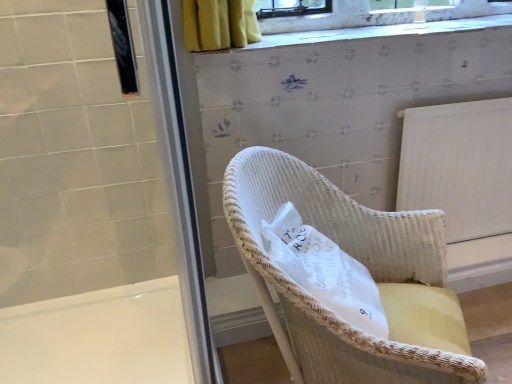
Question: Is white wicker chair at center at the back of white glossy bath at lower left?

Choices:
 (A) yes
 (B) no

Answer: (B)

Question: Would you say white glossy bath at lower left is a long distance from white wicker chair at center?

Choices:
 (A) no
 (B) yes

Answer: (A)

Question: Is white glossy bath at lower left smaller than white wicker chair at center?

Choices:
 (A) yes
 (B) no

Answer: (B)

Question: Does white glossy bath at lower left turn towards white wicker chair at center?

Choices:
 (A) yes
 (B) no

Answer: (B)

Question: Is white glossy bath at lower left in front of white wicker chair at center?

Choices:
 (A) yes
 (B) no

Answer: (B)

Question: From the image's perspective, is white glossy bath at lower left located above white wicker chair at center?

Choices:
 (A) yes
 (B) no

Answer: (B)

Question: Considering the relative sizes of white glossy screen door at upper left, which appears as the 1th screen door when viewed from the left, and white wicker chair at center in the image provided, is white glossy screen door at upper left, which appears as the 1th screen door when viewed from the left, shorter than white wicker chair at center?

Choices:
 (A) no
 (B) yes

Answer: (A)

Question: From the image's perspective, is white glossy screen door at upper left, the 2th screen door in the right-to-left sequence, on top of white wicker chair at center?

Choices:
 (A) no
 (B) yes

Answer: (B)

Question: Is white glossy screen door at upper left, which appears as the 1th screen door when viewed from the left, taller than white wicker chair at center?

Choices:
 (A) no
 (B) yes

Answer: (B)

Question: Is white glossy screen door at upper left, which appears as the 1th screen door when viewed from the left, to the right of white wicker chair at center from the viewer's perspective?

Choices:
 (A) no
 (B) yes

Answer: (A)

Question: Can you confirm if white glossy screen door at upper left, which appears as the 1th screen door when viewed from the left, is wider than white wicker chair at center?

Choices:
 (A) yes
 (B) no

Answer: (B)

Question: Is white glossy screen door at upper left, which appears as the 1th screen door when viewed from the left, turned away from white wicker chair at center?

Choices:
 (A) yes
 (B) no

Answer: (B)

Question: Is white glossy bath at lower left surrounded by white wicker chair at center?

Choices:
 (A) yes
 (B) no

Answer: (B)